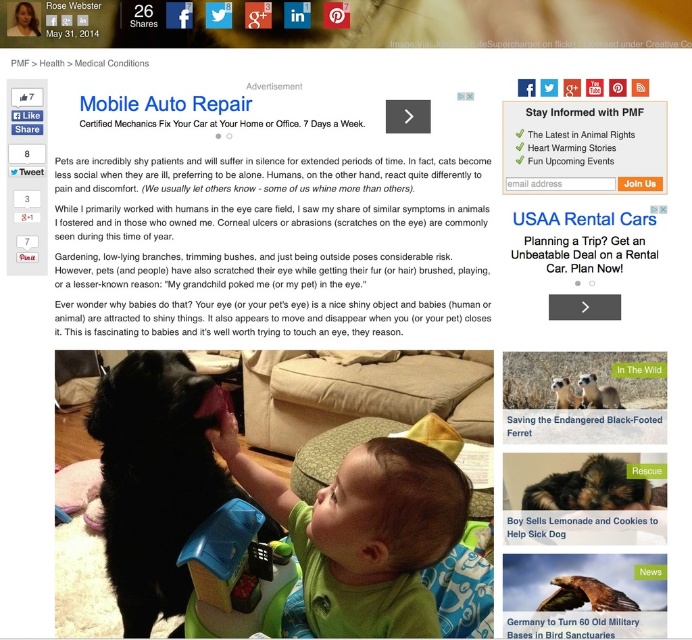
Is brown matte hair at center shorter than endangered black-footed ferret at center?

No, brown matte hair at center is not shorter than endangered black-footed ferret at center.

Which is in front, point (435, 460) or point (527, 419)?

Point (435, 460) is in front.

Does point (441, 552) come farther from viewer compared to point (588, 412)?

No, it is not.

Identify the location of brown matte hair at center. The image size is (692, 640). (417, 502).

Does soft brown fur puppy at center come in front of endangered black-footed ferret at center?

No.

The height and width of the screenshot is (640, 692). Describe the element at coordinates (588, 486) in the screenshot. I see `soft brown fur puppy at center` at that location.

Image resolution: width=692 pixels, height=640 pixels. Identify the location of soft brown fur puppy at center. (588, 486).

This screenshot has height=640, width=692. What do you see at coordinates (417, 502) in the screenshot?
I see `brown matte hair at center` at bounding box center [417, 502].

Who is lower down, brown matte hair at center or soft brown fur puppy at center?

brown matte hair at center

Who is more distant from viewer, (392,516) or (585,468)?

Point (585,468)

Where is `brown matte hair at center`? brown matte hair at center is located at coordinates (417, 502).